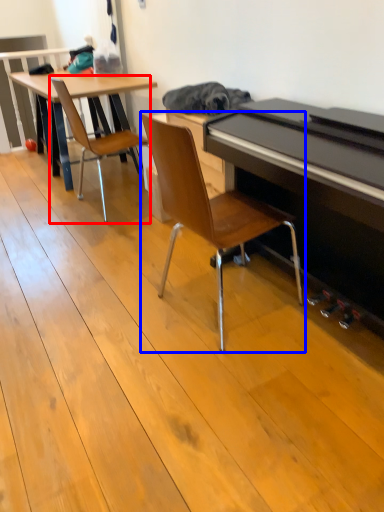
Question: Which point is closer to the camera, chair (highlighted by a red box) or chair (highlighted by a blue box)?

Choices:
 (A) chair
 (B) chair

Answer: (B)